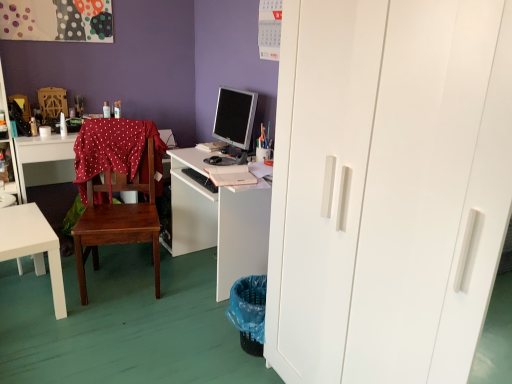
Find the location of a particular element. vacant region in front of wooden chair at center is located at coordinates (114, 327).